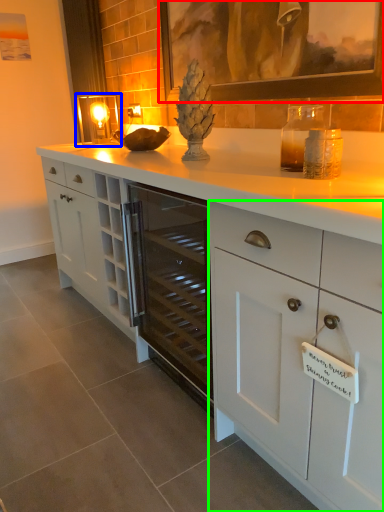
Question: Estimate the real-world distances between objects in this image. Which object is farther from picture frame (highlighted by a red box), candle holder (highlighted by a blue box) or cabinetry (highlighted by a green box)?

Choices:
 (A) candle holder
 (B) cabinetry

Answer: (A)